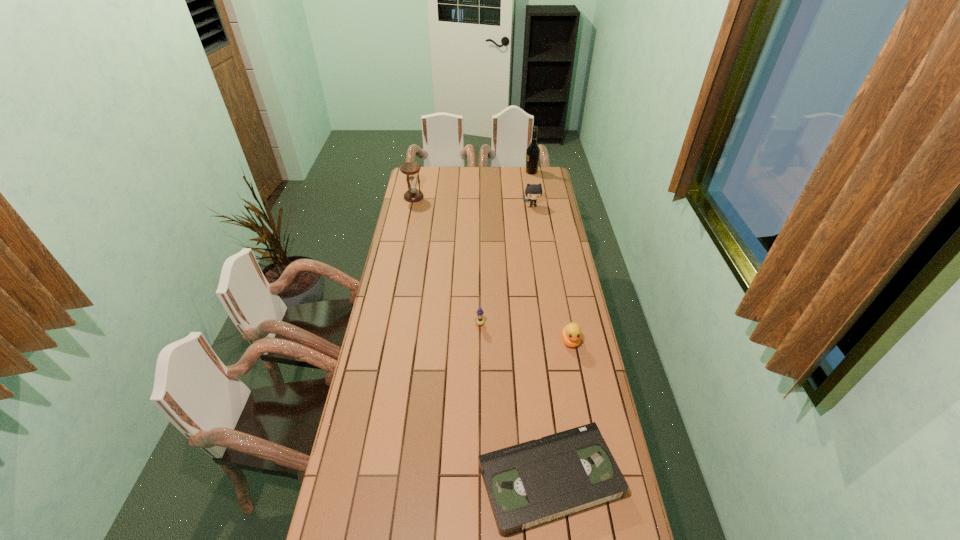
Image resolution: width=960 pixels, height=540 pixels. Identify the location of free space at the far right corner of the desktop. (547, 179).

I want to click on free space between the kitten and the fifth shortest object, so click(x=473, y=201).

Find the location of `blank region between the fifth farthest object and the videotape`. blank region between the fifth farthest object and the videotape is located at coordinates coord(560,410).

The width and height of the screenshot is (960, 540). I want to click on free space between the second nearest object and the third nearest object, so click(x=525, y=333).

This screenshot has width=960, height=540. Find the location of `vacant space in between the hourglass and the nearest object`. vacant space in between the hourglass and the nearest object is located at coordinates (482, 338).

Locate an element on the screen. The height and width of the screenshot is (540, 960). empty space that is in between the right duckling and the third nearest object is located at coordinates (525, 333).

Locate an element on the screen. This screenshot has width=960, height=540. free space that is in between the shortest object and the nearer duckling is located at coordinates (560, 410).

Find the location of `free space that is in between the third tallest object and the nearer duckling`. free space that is in between the third tallest object and the nearer duckling is located at coordinates (551, 273).

The height and width of the screenshot is (540, 960). In order to click on empty space that is in between the farthest object and the hourglass in this screenshot , I will do `click(472, 185)`.

Locate which object ranks fifth in proximity to the tallest object. Please provide its 2D coordinates. Your answer should be formatted as a tuple, i.e. [(x, y)], where the tuple contains the x and y coordinates of a point satisfying the conditions above.

[(538, 481)]